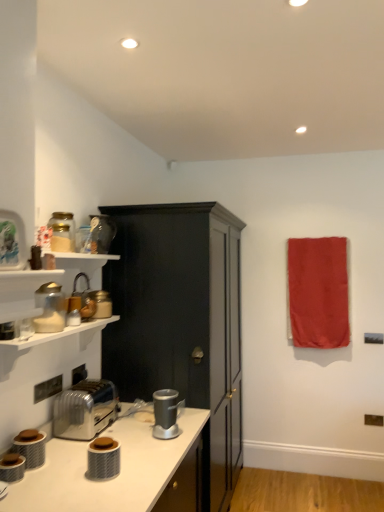
At what (x,y) coordinates should I click in order to perform the action: click on empty space that is ontop of red fabric towel at upper right (from a real-world perspective). Please return your answer as a coordinate pair (x, y). Image resolution: width=384 pixels, height=512 pixels. Looking at the image, I should click on (316, 237).